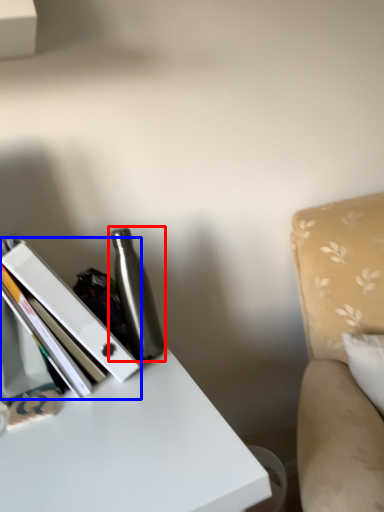
Question: Which object is closer to the camera taking this photo, bottle (highlighted by a red box) or book (highlighted by a blue box)?

Choices:
 (A) bottle
 (B) book

Answer: (B)